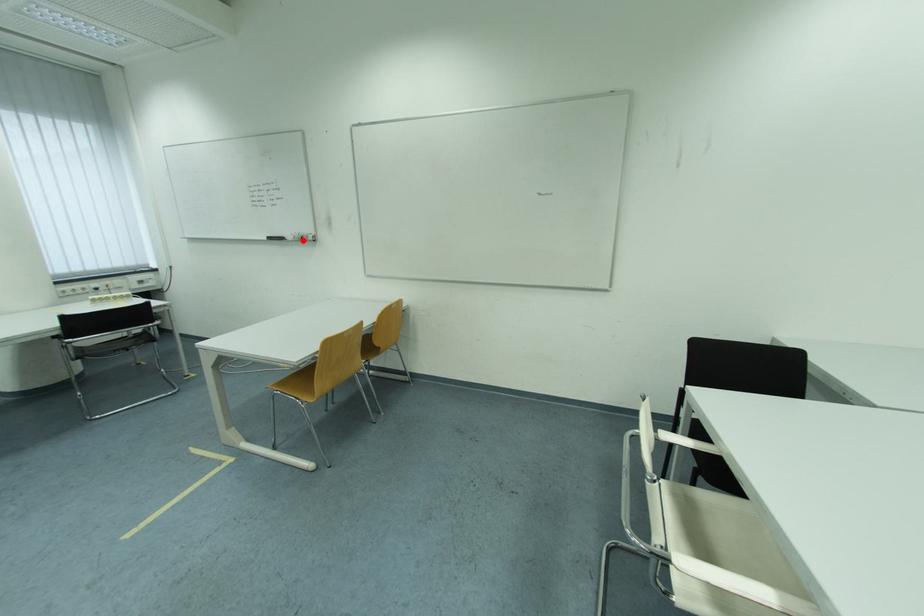
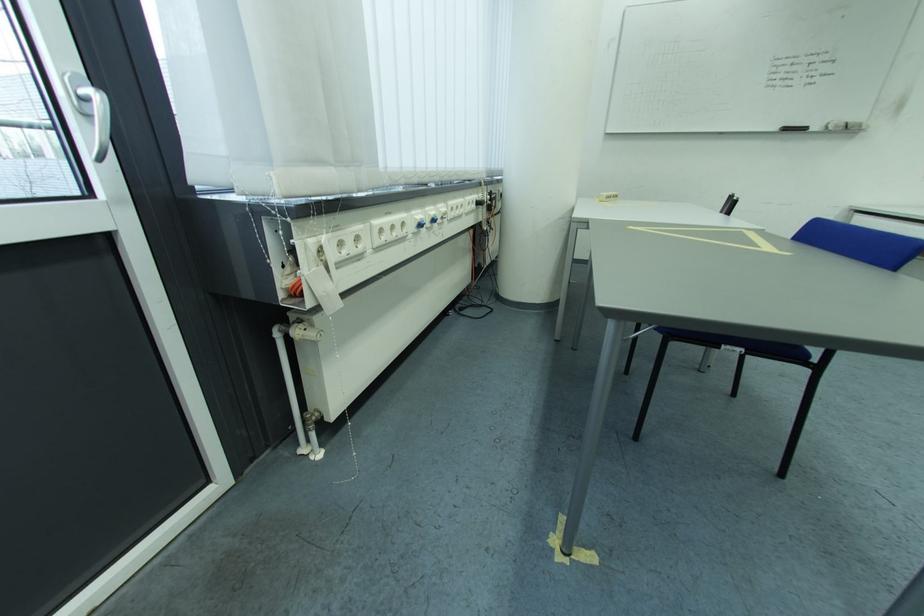
Question: I am providing you with two images of the same scene from different viewpoints. Image1 has a red point marked. In image2, the corresponding 3D location appears at what relative position? Reply with the corresponding letter.

Choices:
 (A) Closer
 (B) Farther

Answer: (B)